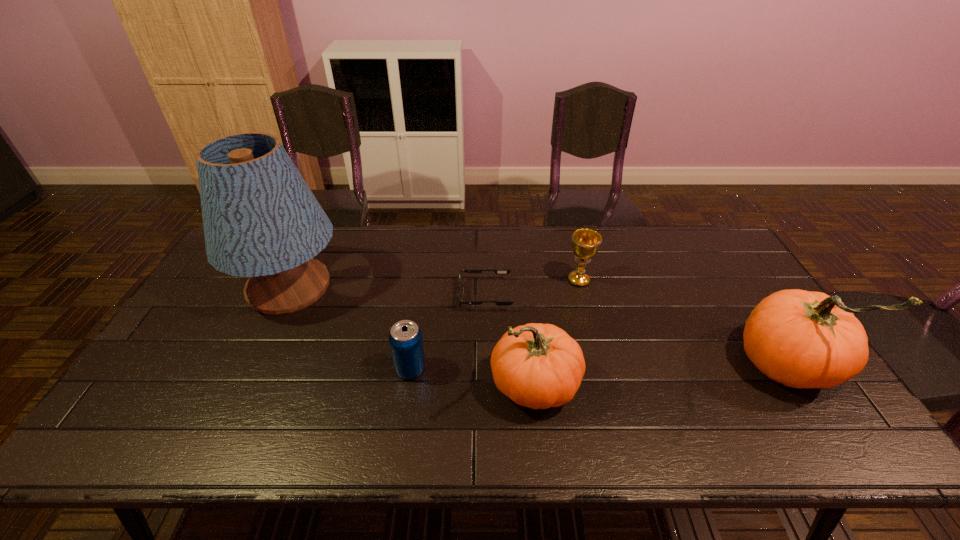
Locate an element on the screen. This screenshot has height=540, width=960. free spot between the sunglasses and the taller pumpkin is located at coordinates (636, 331).

You are a GUI agent. You are given a task and a screenshot of the screen. Output one action in this format:
    pyautogui.click(x=<x>, y=<y>)
    Task: Click on the vacant space that is in between the taller pumpkin and the fifth object from left to right
    This screenshot has height=540, width=960.
    Given the screenshot: What is the action you would take?
    pyautogui.click(x=683, y=323)

Identify the location of free space between the fifth object from right to left and the right pumpkin. (599, 368).

Identify the location of vacant area that lies between the shortest object and the second shortest object. (448, 332).

Locate an element on the screen. The image size is (960, 540). vacant area that lies between the lampshade and the pop soda is located at coordinates (350, 328).

Identify the location of free area in between the second shortest object and the lampshade. (350, 328).

Image resolution: width=960 pixels, height=540 pixels. In order to click on free space between the pop soda and the second object from right to left in this screenshot , I will do `click(494, 325)`.

This screenshot has height=540, width=960. Identify the location of vacant region between the pop soda and the leftmost object. (350, 328).

Select which object is the fourth closest to the shorter pumpkin. Please provide its 2D coordinates. Your answer should be formatted as a tuple, i.e. [(x, y)], where the tuple contains the x and y coordinates of a point satisfying the conditions above.

[(801, 339)]

The width and height of the screenshot is (960, 540). Find the location of `object that stands as the fifth closest to the second object from right to left`. object that stands as the fifth closest to the second object from right to left is located at coordinates (261, 220).